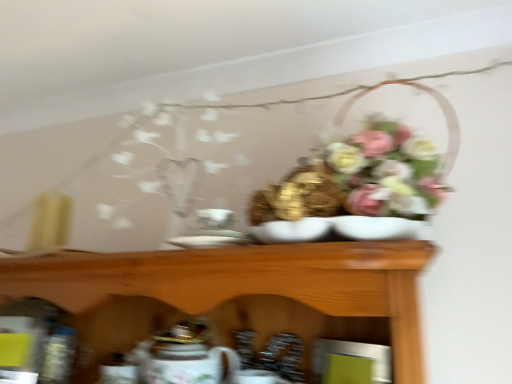
This screenshot has width=512, height=384. Describe the element at coordinates (183, 356) in the screenshot. I see `white glossy teapot at lower center` at that location.

Measure the distance between white glossy teapot at lower center and camera.

32.89 inches.

You are a GUI agent. You are given a task and a screenshot of the screen. Output one action in this format:
    pyautogui.click(x=<x>, y=<y>)
    Task: Click on the white glossy teapot at lower center
    The width and height of the screenshot is (512, 384).
    Given the screenshot: What is the action you would take?
    pyautogui.click(x=183, y=356)

What is the approximate height of white glossy teapot at lower center?

7.01 inches.

Where is `white glossy teapot at lower center`? The width and height of the screenshot is (512, 384). white glossy teapot at lower center is located at coordinates (183, 356).